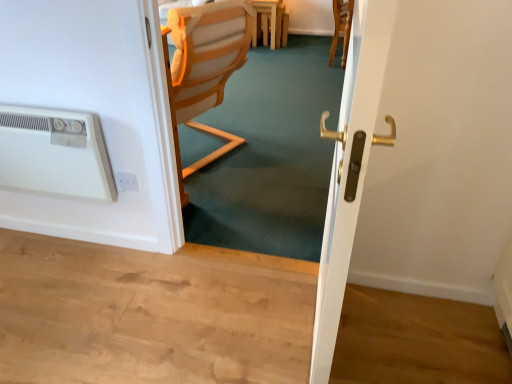
Question: Does white plastic electric outlet at lower left have a greater height compared to wooden chair at center?

Choices:
 (A) yes
 (B) no

Answer: (B)

Question: Considering the relative positions of white plastic electric outlet at lower left and wooden chair at center in the image provided, is white plastic electric outlet at lower left to the right of wooden chair at center from the viewer's perspective?

Choices:
 (A) yes
 (B) no

Answer: (B)

Question: Is the position of white plastic electric outlet at lower left more distant than that of wooden chair at center?

Choices:
 (A) yes
 (B) no

Answer: (B)

Question: Is white plastic electric outlet at lower left aimed at wooden chair at center?

Choices:
 (A) yes
 (B) no

Answer: (B)

Question: From the image's perspective, is white plastic electric outlet at lower left located beneath wooden chair at center?

Choices:
 (A) yes
 (B) no

Answer: (A)

Question: Considering the relative sizes of white plastic electric outlet at lower left and wooden chair at center in the image provided, is white plastic electric outlet at lower left wider than wooden chair at center?

Choices:
 (A) yes
 (B) no

Answer: (B)

Question: Is white glossy door handle at center oriented towards light brown wooden table at center?

Choices:
 (A) yes
 (B) no

Answer: (B)

Question: Is white glossy door handle at center bigger than light brown wooden table at center?

Choices:
 (A) no
 (B) yes

Answer: (B)

Question: Does white glossy door handle at center have a lesser width compared to light brown wooden table at center?

Choices:
 (A) yes
 (B) no

Answer: (A)

Question: Are white glossy door handle at center and light brown wooden table at center far apart?

Choices:
 (A) no
 (B) yes

Answer: (B)

Question: Are white glossy door handle at center and light brown wooden table at center making contact?

Choices:
 (A) yes
 (B) no

Answer: (B)

Question: Is white glossy door handle at center at the right side of light brown wooden table at center?

Choices:
 (A) no
 (B) yes

Answer: (B)

Question: Can you confirm if white plastic air conditioning unit at left is wider than wooden chair at center?

Choices:
 (A) yes
 (B) no

Answer: (B)